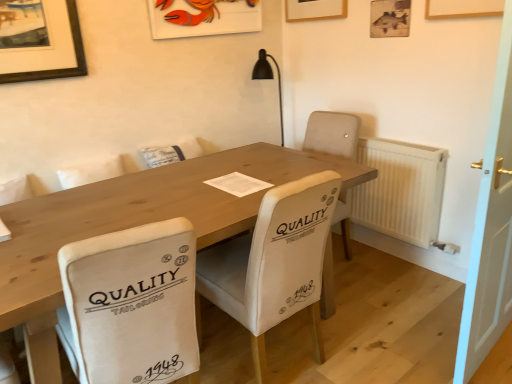
The height and width of the screenshot is (384, 512). What are the coordinates of `unoccupied space behind white wooden door at right` in the screenshot? It's located at (424, 293).